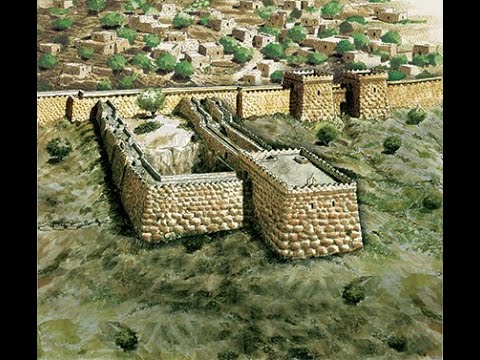
Where is `walls`? walls is located at coordinates (259, 104), (407, 90).